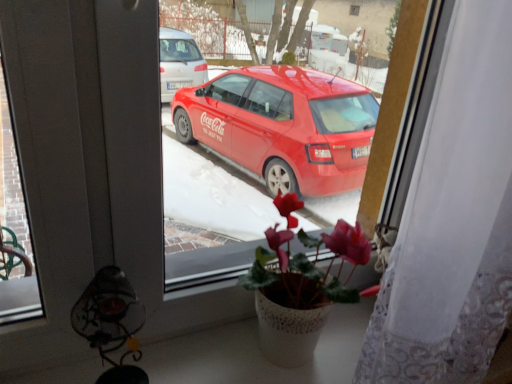
The height and width of the screenshot is (384, 512). Identify the location of vacant area on the back side of metallic wire lamp at lower left. (155, 347).